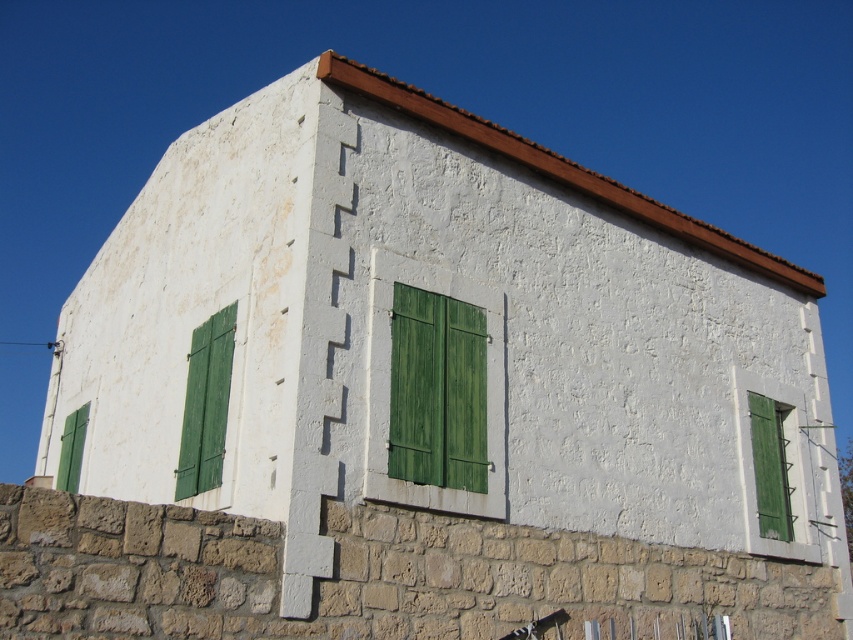
Based on the photo, does green painted wood at center have a lesser height compared to green matte shutters at left?

No, green painted wood at center is not shorter than green matte shutters at left.

Is point (421, 404) in front of point (218, 356)?

Yes, point (421, 404) is in front of point (218, 356).

At what (x,y) coordinates should I click in order to perform the action: click on green painted wood at center. Please return your answer as a coordinate pair (x, y). The image size is (853, 640). Looking at the image, I should click on (437, 390).

Which of these two, green matte shutters at left or green matte shutter at lower left, stands taller?

green matte shutters at left

Locate an element on the screen. green matte shutters at left is located at coordinates (206, 404).

Does green painted wood at center have a lesser height compared to green matte shutter at lower left?

Incorrect, green painted wood at center's height does not fall short of green matte shutter at lower left's.

Is point (427, 380) positioned behind point (73, 458)?

No, it is not.

Does point (404, 320) come in front of point (73, 467)?

Yes, it is in front of point (73, 467).

The height and width of the screenshot is (640, 853). I want to click on green painted wood at center, so click(437, 390).